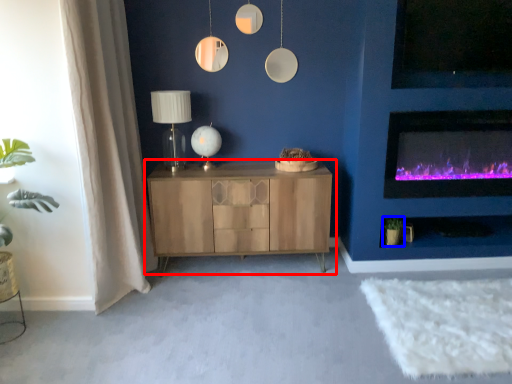
Question: Which of the following is the farthest to the observer, cabinetry (highlighted by a red box) or plant (highlighted by a blue box)?

Choices:
 (A) cabinetry
 (B) plant

Answer: (B)